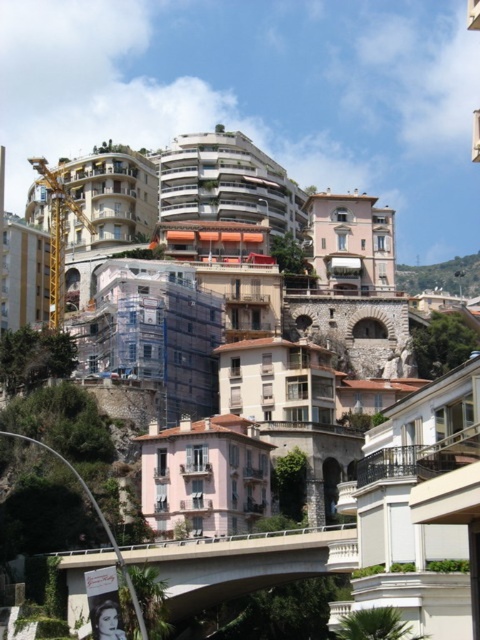
Question: Can you confirm if concrete bridge at center is bigger than green stone wall at upper center?

Choices:
 (A) yes
 (B) no

Answer: (B)

Question: Which point appears closest to the camera in this image?

Choices:
 (A) (179, 541)
 (B) (85, 218)
 (C) (419, 289)

Answer: (A)

Question: Does concrete bridge at center have a larger size compared to green stone wall at upper center?

Choices:
 (A) no
 (B) yes

Answer: (A)

Question: Which of the following is the farthest from the observer?

Choices:
 (A) (192, 588)
 (B) (478, 291)
 (C) (62, 244)

Answer: (B)

Question: Is concrete bridge at center to the right of yellow metallic crane at left from the viewer's perspective?

Choices:
 (A) no
 (B) yes

Answer: (B)

Question: Which point is closer to the camera?

Choices:
 (A) click(465, 296)
 (B) click(201, 586)

Answer: (B)